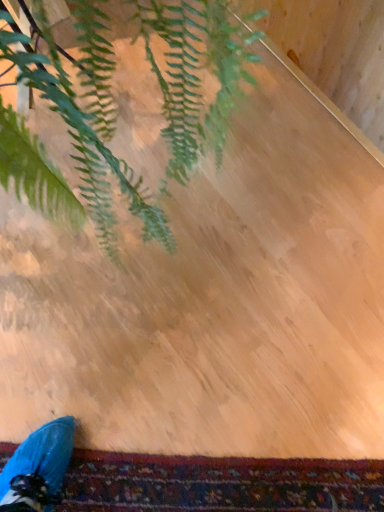
At what (x,y) coordinates should I click in order to perform the action: click on vacant space in front of green leafy plant at upper left. Please return your answer as a coordinate pair (x, y). Looking at the image, I should click on (191, 397).